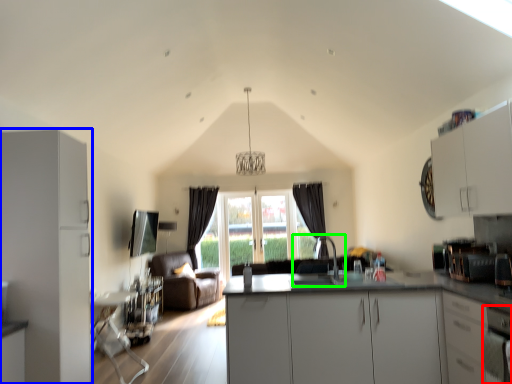
Question: Estimate the real-world distances between objects in this image. Which object is closer to oven (highlighted by a red box), cabinetry (highlighted by a blue box) or sink (highlighted by a green box)?

Choices:
 (A) cabinetry
 (B) sink

Answer: (A)